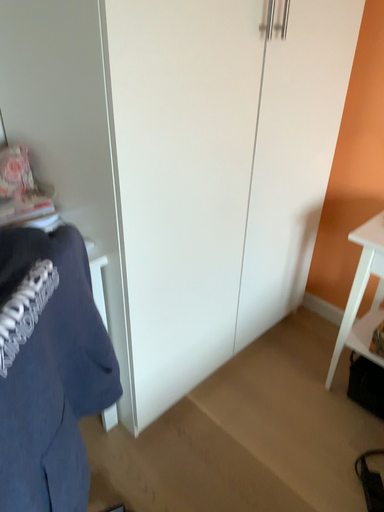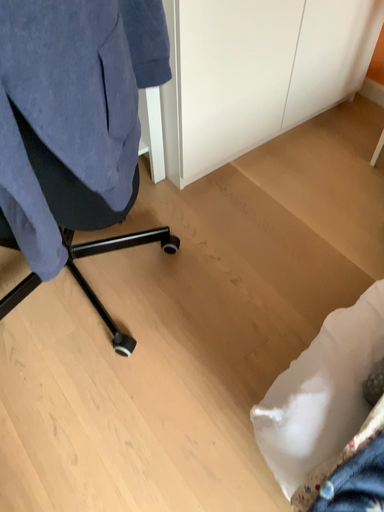
Question: How did the camera likely rotate when shooting the video?

Choices:
 (A) rotated left
 (B) rotated right

Answer: (A)